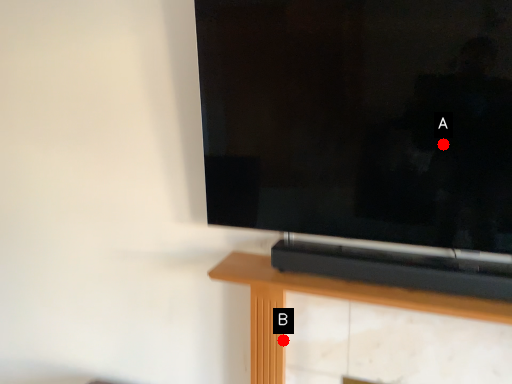
Question: Two points are circled on the image, labeled by A and B beside each circle. Among these points, which one is nearest to the camera?

Choices:
 (A) A is closer
 (B) B is closer

Answer: (A)